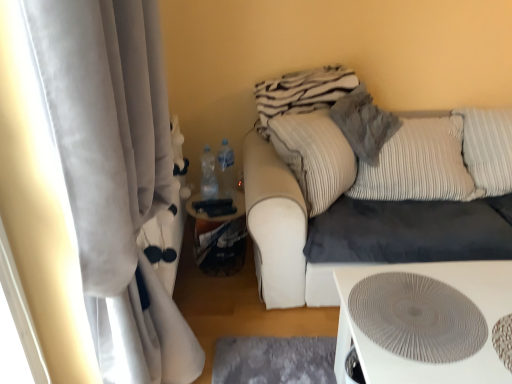
Where is `vacant point above white textured table at lower right (from a real-world perspective)`? The image size is (512, 384). vacant point above white textured table at lower right (from a real-world perspective) is located at coordinates (442, 311).